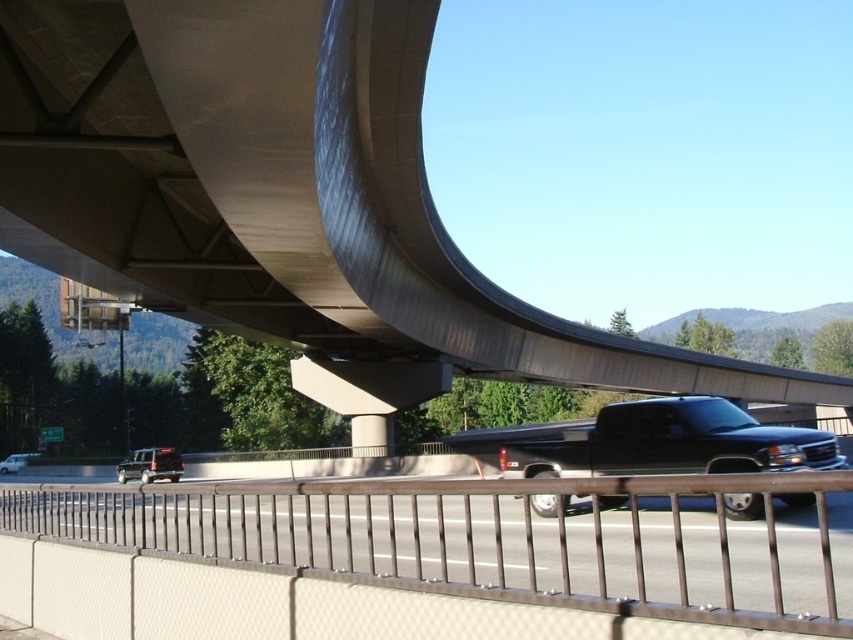
Between black glossy truck at center and matte black suv at lower left, which one has more height?

black glossy truck at center is taller.

Between point (672, 436) and point (126, 470), which one is positioned behind?

The point (126, 470) is more distant.

This screenshot has width=853, height=640. I want to click on black glossy truck at center, so click(x=671, y=444).

Can you confirm if concrete at center is wider than silver metallic sedan at lower left?

Indeed, concrete at center has a greater width compared to silver metallic sedan at lower left.

Can you confirm if concrete at center is shorter than silver metallic sedan at lower left?

Incorrect, concrete at center's height does not fall short of silver metallic sedan at lower left's.

Find the location of `concrete at center`. concrete at center is located at coordinates (286, 196).

In the scene shown: Does brown metal fence at lower center lie behind black glossy truck at center?

No, brown metal fence at lower center is in front of black glossy truck at center.

Can you confirm if brown metal fence at lower center is bigger than black glossy truck at center?

No, brown metal fence at lower center is not bigger than black glossy truck at center.

Where is `brown metal fence at lower center`? The image size is (853, 640). brown metal fence at lower center is located at coordinates (422, 561).